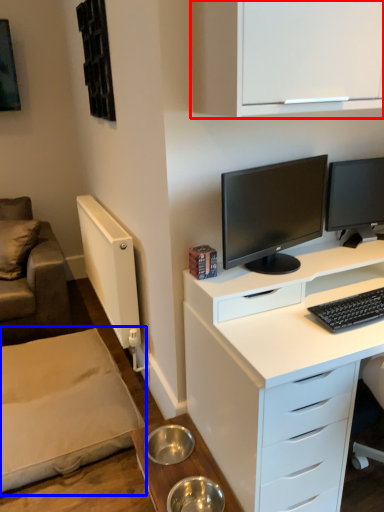
Question: Which object appears farthest to the camera in this image, cabinetry (highlighted by a red box) or plain (highlighted by a blue box)?

Choices:
 (A) cabinetry
 (B) plain

Answer: (B)